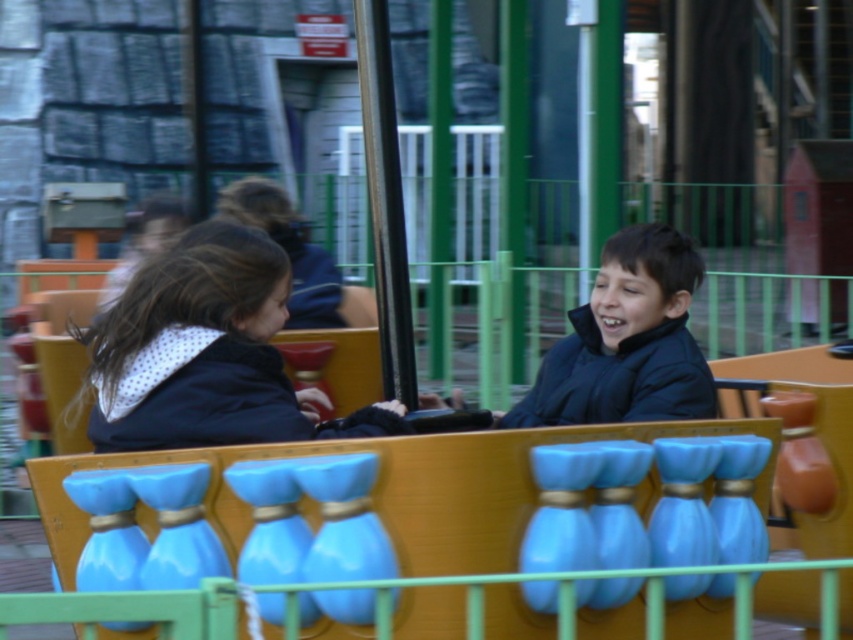
You are a maintenance worker at the amusement park and need to check the distance between the two black jackets. The safety guidelines state that the minimum distance between riders should be at least 36 inches. Can the ride operate safely with the current spacing between the matte black jacket at left and the black matte jacket at center?

The distance between the matte black jacket at left and the black matte jacket at center is 37.30 inches, which exceeds the minimum required 36 inches. Therefore, the ride can operate safely with the current spacing.

You are a photographer trying to capture the children in the amusement park ride. You notice the matte black jacket at left and the black matte jacket at center. Which jacket is positioned lower in the image?

The matte black jacket at left is below the black matte jacket at center, so the matte black jacket at left is positioned lower in the image.